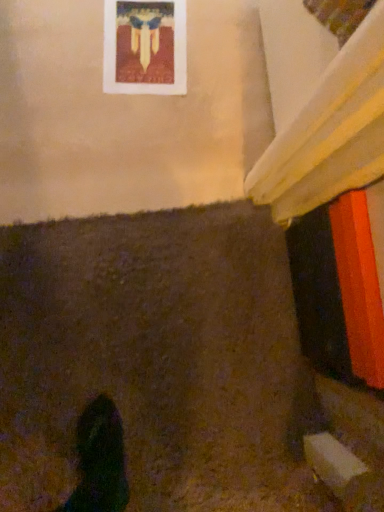
The image size is (384, 512). Find the location of `free space underneath matte paper picture frame at upper center (from a real-world perspective)`. free space underneath matte paper picture frame at upper center (from a real-world perspective) is located at coordinates point(142,37).